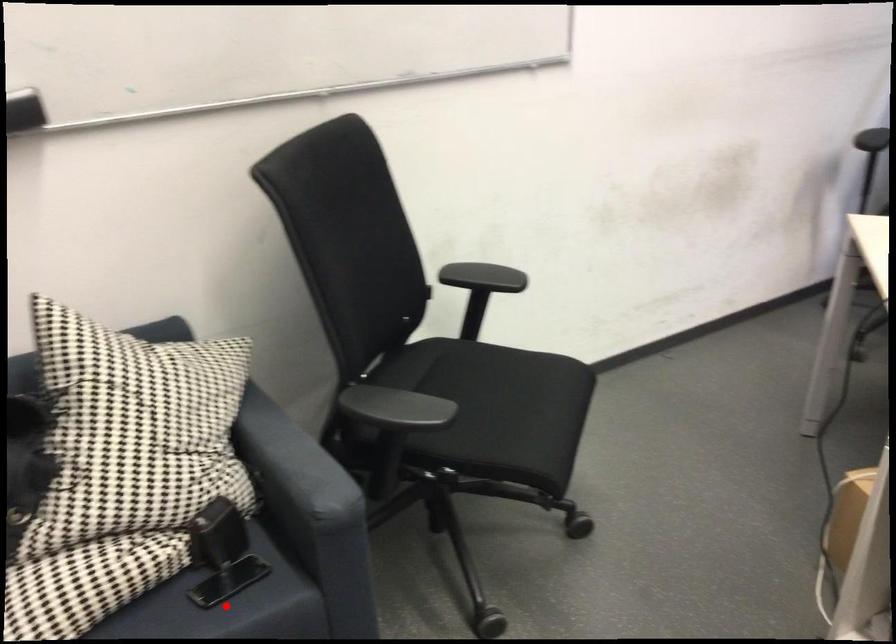
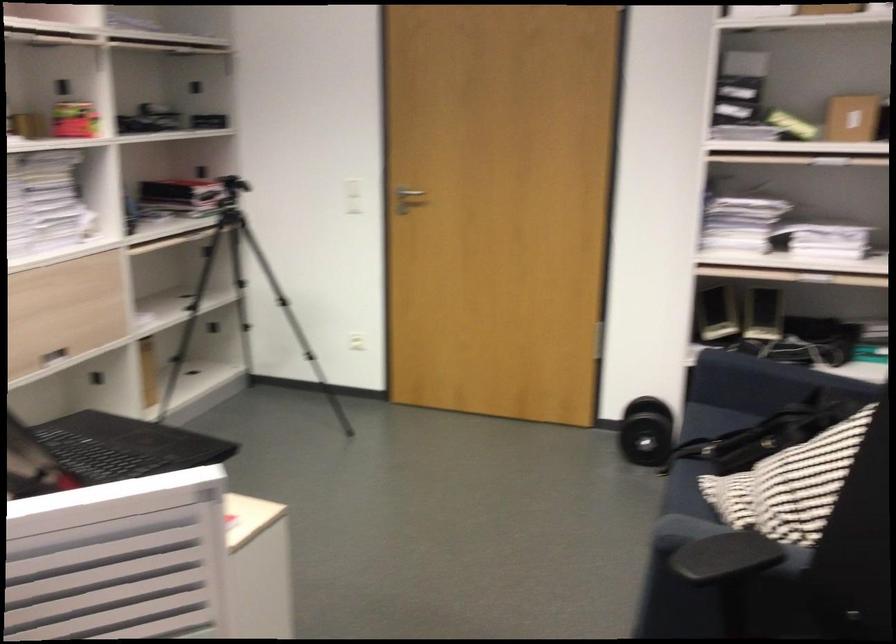
Question: I am providing you with two images of the same scene from different viewpoints. A red point is marked on the first image. At the location where the point appears in image 1, is it still visible in image 2?

Choices:
 (A) Yes
 (B) No

Answer: (B)